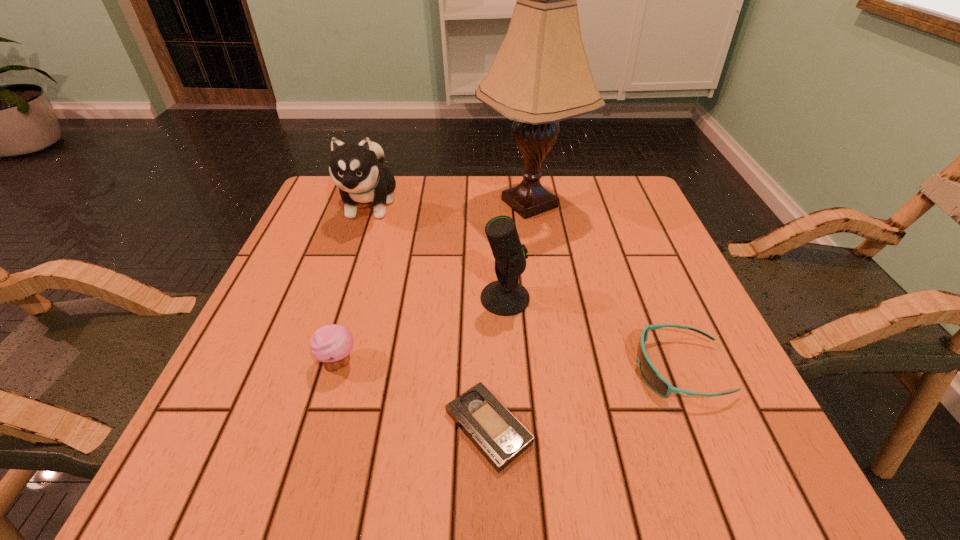
This screenshot has height=540, width=960. Identify the location of free space between the sunglasses and the shortest object. (584, 399).

Locate an element on the screen. The height and width of the screenshot is (540, 960). free space between the cupcake and the sunglasses is located at coordinates (509, 366).

At what (x,y) coordinates should I click in order to perform the action: click on vacant region between the cupcake and the lamp. Please return your answer as a coordinate pair (x, y). The width and height of the screenshot is (960, 540). Looking at the image, I should click on (434, 283).

In order to click on empty space that is in between the cupcake and the puppy in this screenshot , I will do `click(354, 283)`.

Where is `vacant space that is in between the puppy and the tallest object`? vacant space that is in between the puppy and the tallest object is located at coordinates (449, 204).

What are the coordinates of `empty space between the videotape and the puppy` in the screenshot? It's located at (429, 316).

This screenshot has width=960, height=540. In order to click on vacant area between the sunglasses and the microphone in this screenshot , I will do `click(592, 334)`.

The width and height of the screenshot is (960, 540). I want to click on vacant space that is in between the videotape and the microphone, so click(496, 363).

Locate an element on the screen. Image resolution: width=960 pixels, height=540 pixels. the second closest object relative to the microphone is located at coordinates (500, 437).

Locate which object is the third closest to the microphone. Please provide its 2D coordinates. Your answer should be formatted as a tuple, i.e. [(x, y)], where the tuple contains the x and y coordinates of a point satisfying the conditions above.

[(650, 374)]